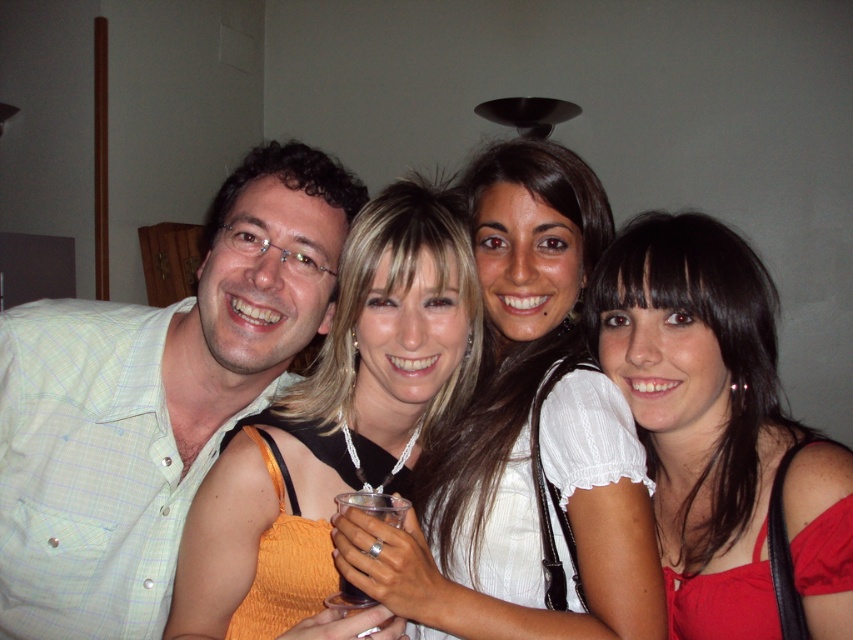
Question: Can you confirm if matte red dress at lower right is smaller than orange satin dress at center?

Choices:
 (A) yes
 (B) no

Answer: (A)

Question: Is white satin blouse at center thinner than matte red dress at lower right?

Choices:
 (A) no
 (B) yes

Answer: (A)

Question: Which object appears closest to the camera in this image?

Choices:
 (A) green checkered shirt at left
 (B) matte red dress at lower right
 (C) dark translucent plastic cup at center

Answer: (C)

Question: Is green checkered shirt at left to the left of orange satin dress at center from the viewer's perspective?

Choices:
 (A) no
 (B) yes

Answer: (B)

Question: Which point appears closest to the camera in this image?

Choices:
 (A) pyautogui.click(x=213, y=211)
 (B) pyautogui.click(x=346, y=598)
 (C) pyautogui.click(x=364, y=312)

Answer: (B)

Question: Based on their relative distances, which object is nearer to the white satin blouse at center?

Choices:
 (A) dark translucent plastic cup at center
 (B) matte red dress at lower right
 (C) orange satin dress at center

Answer: (C)